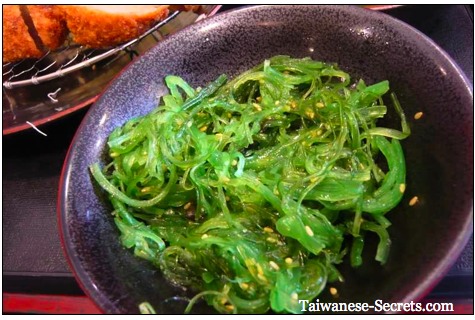
This screenshot has width=475, height=320. What are the coordinates of `black counter` in the screenshot? It's located at [x=27, y=236].